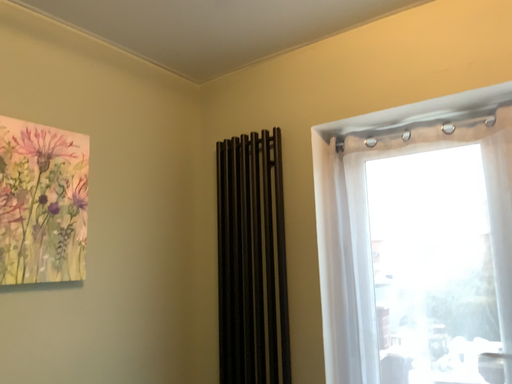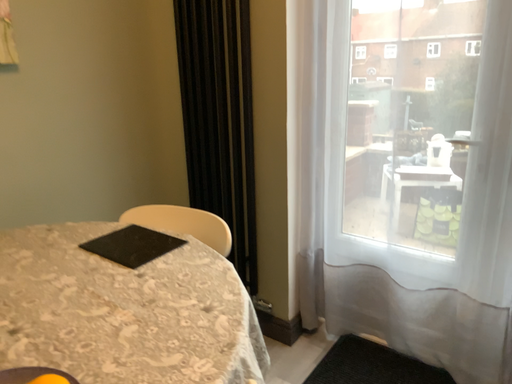
Question: How did the camera likely rotate when shooting the video?

Choices:
 (A) rotated downward
 (B) rotated upward

Answer: (A)